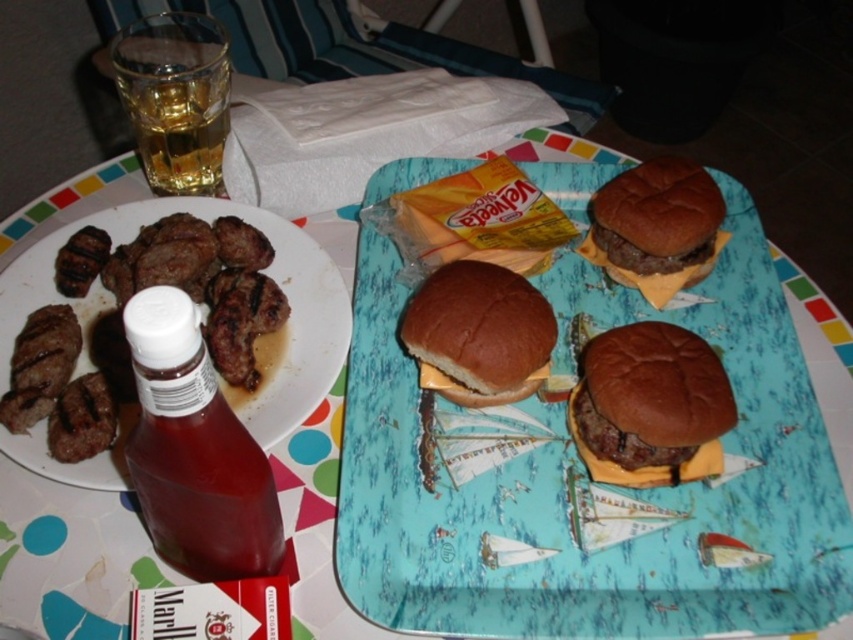
Can you confirm if brown matte cheeseburger at center is thinner than brown matte burger at center?

Correct, brown matte cheeseburger at center's width is less than brown matte burger at center's.

Which is behind, point (601, 436) or point (706, 266)?

The point (706, 266) is behind.

Identify the location of brown matte cheeseburger at center. Image resolution: width=853 pixels, height=640 pixels. (650, 404).

Who is higher up, brown charred meat at left or brown matte burger at center?

brown matte burger at center

Who is more forward, (107, 246) or (602, 252)?

Point (107, 246)

Where is `brown charred meat at left`? brown charred meat at left is located at coordinates (122, 324).

Who is positioned more to the right, translucent plastic bottle at lower left or brown bread hamburger at center?

From the viewer's perspective, brown bread hamburger at center appears more on the right side.

Between translucent plastic bottle at lower left and brown bread hamburger at center, which one has more height?

With more height is translucent plastic bottle at lower left.

Describe the element at coordinates (194, 451) in the screenshot. I see `translucent plastic bottle at lower left` at that location.

Locate an element on the screen. Image resolution: width=853 pixels, height=640 pixels. translucent plastic bottle at lower left is located at coordinates [x=194, y=451].